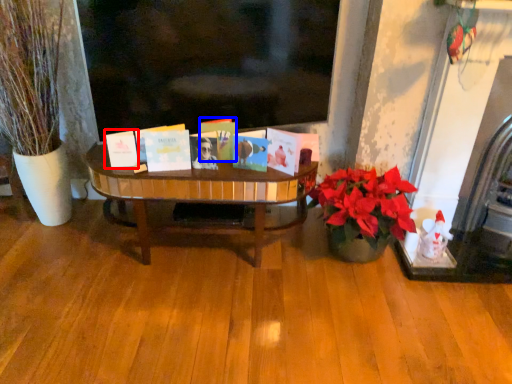
Question: Which point is further to the camera, book (highlighted by a red box) or book (highlighted by a blue box)?

Choices:
 (A) book
 (B) book

Answer: (B)